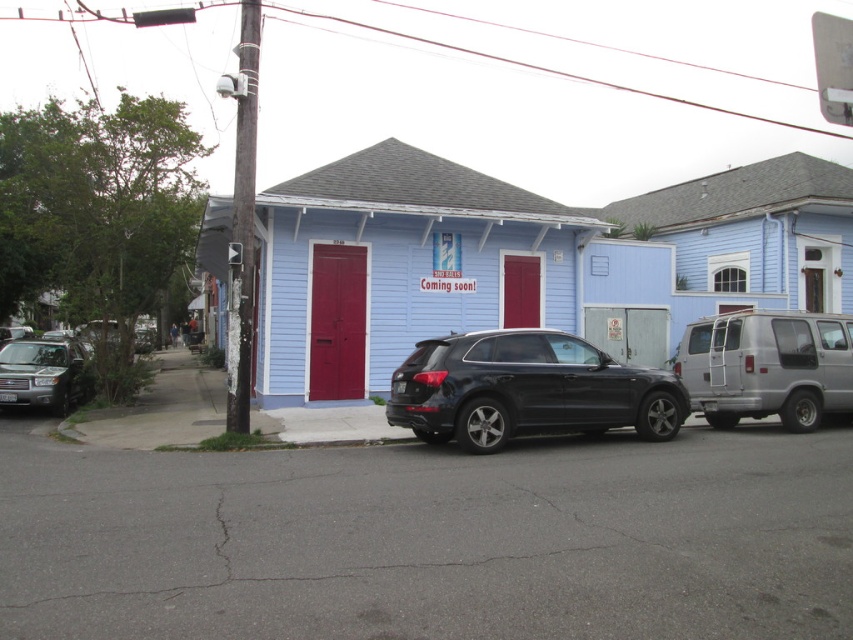
Is silver metallic van at right wider than silver metallic suv at left?

Yes, silver metallic van at right is wider than silver metallic suv at left.

Is silver metallic van at right above silver metallic suv at left?

Correct, silver metallic van at right is located above silver metallic suv at left.

Which is behind, point (787, 371) or point (22, 392)?

Positioned behind is point (22, 392).

Locate an element on the screen. silver metallic van at right is located at coordinates (767, 365).

Who is more forward, (531, 387) or (4, 404)?

Point (531, 387) is in front.

At what (x,y) coordinates should I click in order to perform the action: click on matte black suv at center. Please return your answer as a coordinate pair (x, y). Looking at the image, I should click on (527, 390).

Is point (495, 342) less distant than point (830, 396)?

That is True.

Is point (595, 364) positioned after point (770, 392)?

No.

Where is `matte black suv at center`? The image size is (853, 640). matte black suv at center is located at coordinates (527, 390).